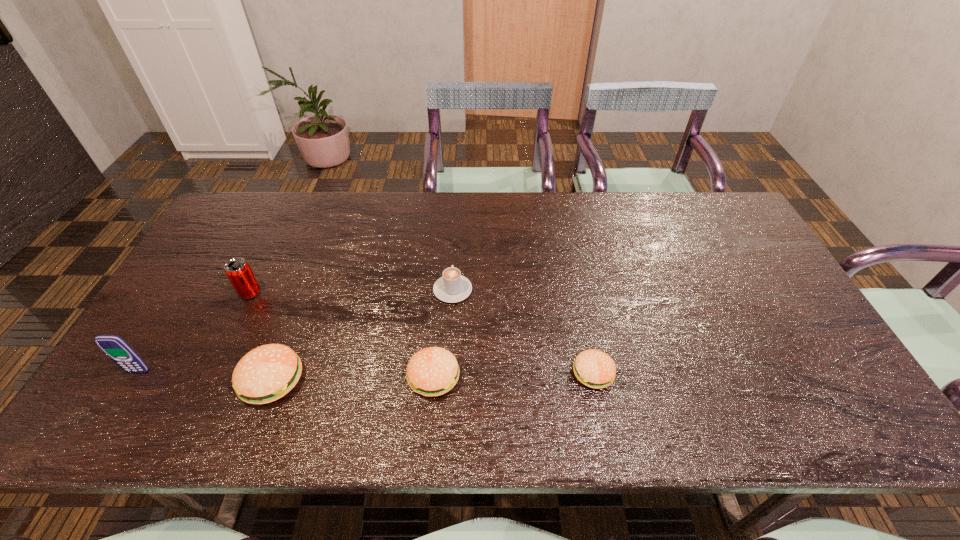
Identify the location of the third object from left to right. click(x=267, y=373).

In order to click on the tallest patty in this screenshot , I will do `click(267, 373)`.

You are a GUI agent. You are given a task and a screenshot of the screen. Output one action in this format:
    pyautogui.click(x=<x>, y=<y>)
    Task: Click on the second patty from left to right
    
    Given the screenshot: What is the action you would take?
    pyautogui.click(x=433, y=371)

The image size is (960, 540). Identify the location of the shortest object. (594, 368).

Locate an element on the screen. The image size is (960, 540). the rightmost object is located at coordinates (594, 368).

Locate an element on the screen. cappuccino is located at coordinates click(x=452, y=287).

The width and height of the screenshot is (960, 540). Identify the location of the fifth shortest object. (238, 271).

At what (x,y) coordinates should I click in order to perform the action: click on soda can. Please return your answer as a coordinate pair (x, y). Looking at the image, I should click on (238, 271).

Identify the location of cellular telephone. Image resolution: width=960 pixels, height=540 pixels. (114, 347).

Identify the location of free space located on the back of the leftmost patty. (311, 276).